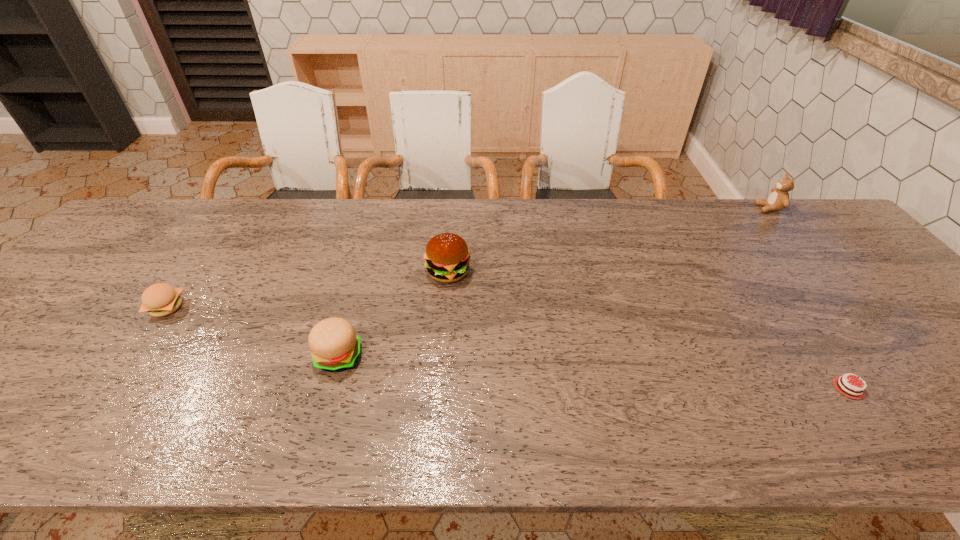
You are a GUI agent. You are given a task and a screenshot of the screen. Output one action in this format:
    pyautogui.click(x=<x>, y=<y>)
    Task: Click on the free space between the chocolate cake and the fourth nearest object
    
    Given the screenshot: What is the action you would take?
    pyautogui.click(x=648, y=330)

Locate an element on the screen. This screenshot has width=960, height=540. free area in between the farthest object and the shortest object is located at coordinates (808, 298).

This screenshot has height=540, width=960. Find the location of `free space that is in between the chocolate cake and the second hamburger from right to left`. free space that is in between the chocolate cake and the second hamburger from right to left is located at coordinates (593, 372).

Image resolution: width=960 pixels, height=540 pixels. Identify the location of vacant region between the shortest object and the nearest hamburger. (593, 372).

Where is `free spot between the rightmost hamburger and the rightmost object`? free spot between the rightmost hamburger and the rightmost object is located at coordinates (609, 240).

Where is `object that stands as the closest to the rightmost object`? Image resolution: width=960 pixels, height=540 pixels. object that stands as the closest to the rightmost object is located at coordinates (862, 396).

At what (x,y) coordinates should I click in order to perform the action: click on the fourth closest object to the second tallest hamburger. Please return your answer as a coordinate pair (x, y). Looking at the image, I should click on (778, 200).

Where is `hamburger that is the nearest to the third shortest object`? Image resolution: width=960 pixels, height=540 pixels. hamburger that is the nearest to the third shortest object is located at coordinates (447, 256).

Identify which hamburger is the nearest to the rightmost hamburger. Please provide its 2D coordinates. Your answer should be formatted as a tuple, i.e. [(x, y)], where the tuple contains the x and y coordinates of a point satisfying the conditions above.

[(334, 345)]

The width and height of the screenshot is (960, 540). I want to click on free space in the image that satisfies the following two spatial constraints: 1. on the back side of the leftmost hamburger; 2. on the left side of the tallest hamburger, so click(x=191, y=272).